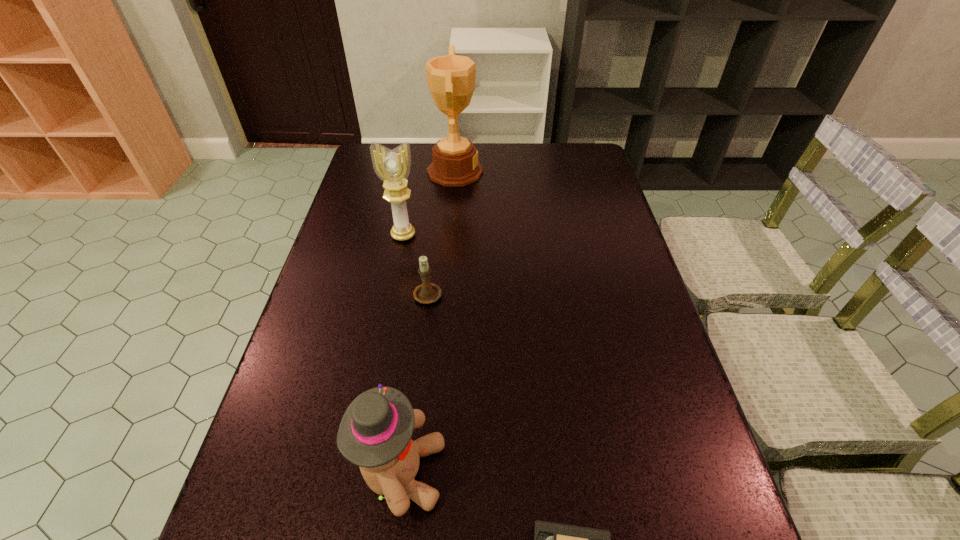
Locate an element on the screen. free space located 0.360m on the side of the candle holder with the handle is located at coordinates (438, 203).

Identify the location of blank space located on the side of the candle holder with the handle. The width and height of the screenshot is (960, 540). (437, 218).

Identify the location of free space located 0.200m on the side of the candle holder with the handle. (435, 234).

Where is `object located at the far edge`? The image size is (960, 540). object located at the far edge is located at coordinates (451, 78).

Identify the location of object at the left edge. (393, 166).

At what (x,y) coordinates should I click in order to perform the action: click on vacant space at the far edge of the desktop. Please return your answer as a coordinate pair (x, y). The width and height of the screenshot is (960, 540). Looking at the image, I should click on (513, 153).

Identify the location of free space at the left edge of the desktop. (341, 379).

Find the location of a particular element. vacant space at the right edge of the desktop is located at coordinates (612, 241).

In the image, there is a desktop. At what (x,y) coordinates should I click in order to perform the action: click on vacant space at the far right corner. Please return your answer as a coordinate pair (x, y). Image resolution: width=960 pixels, height=540 pixels. Looking at the image, I should click on (590, 147).

Locate an element on the screen. free point between the rag_doll and the candle holder is located at coordinates (415, 383).